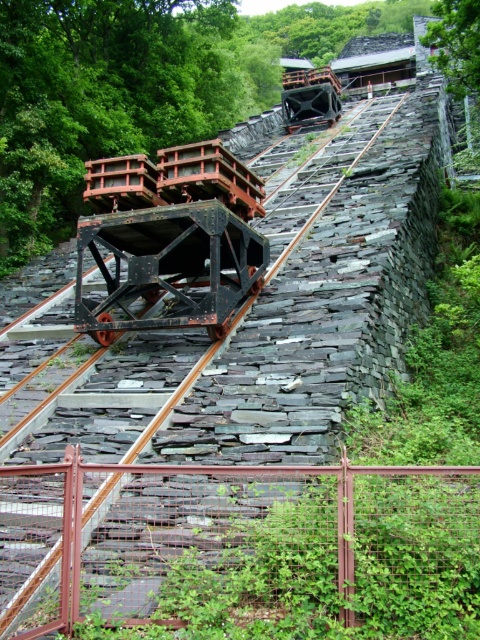
Question: Which point is farther to the camera?

Choices:
 (A) rusty metal train track at center
 (B) rusty metal rail at center

Answer: (A)

Question: Is rusty metal rail at center below rusty metal train track at center?

Choices:
 (A) yes
 (B) no

Answer: (A)

Question: Can you confirm if rusty metal rail at center is thinner than rusty metal train track at center?

Choices:
 (A) no
 (B) yes

Answer: (B)

Question: Is rusty metal rail at center closer to the viewer compared to rusty metal train track at center?

Choices:
 (A) yes
 (B) no

Answer: (A)